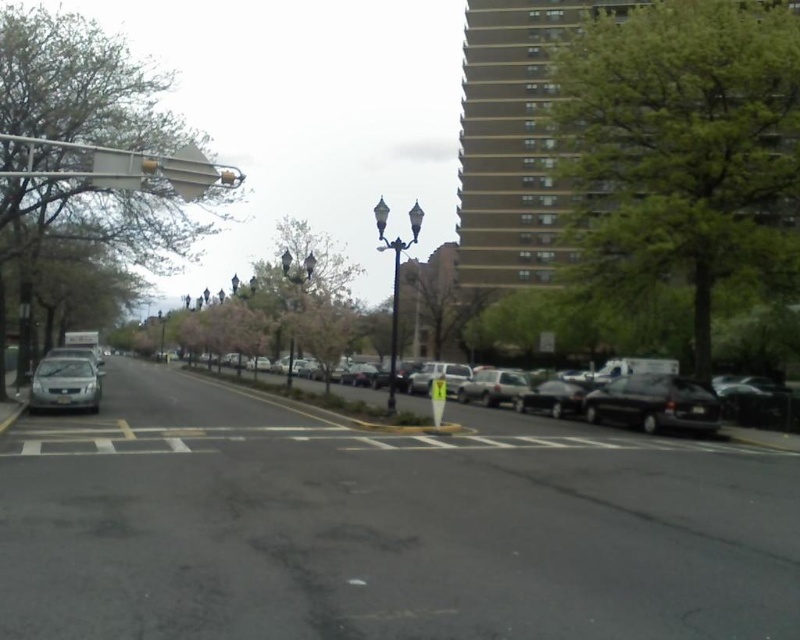
Question: Among these points, which one is farthest from the camera?

Choices:
 (A) (48, 13)
 (B) (68, 385)
 (C) (158, 317)

Answer: (C)

Question: Observing the image, what is the correct spatial positioning of green leafy tree at left in reference to green leafy tree at center?

Choices:
 (A) left
 (B) right

Answer: (A)

Question: Estimate the real-world distances between objects in this image. Which object is closer to the polished brass streetlight at center?

Choices:
 (A) matte black sedan at right
 (B) satin silver sedan at lower left
 (C) black metal lamp post at center
 (D) green leafy tree at upper right

Answer: (D)

Question: Observing the image, what is the correct spatial positioning of green leafy tree at upper right in reference to matte black sedan at right?

Choices:
 (A) left
 (B) right

Answer: (B)

Question: Among these objects, which one is nearest to the camera?

Choices:
 (A) green leafy tree at center
 (B) matte black sedan at right

Answer: (B)

Question: Is green leafy tree at upper right thinner than metallic silver traffic light at upper left?

Choices:
 (A) no
 (B) yes

Answer: (A)